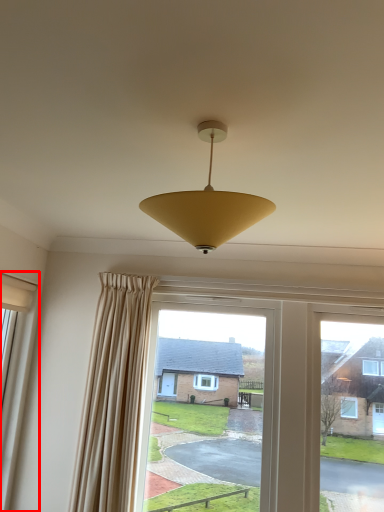
Question: Where is window (annotated by the red box) located in relation to lamp in the image?

Choices:
 (A) right
 (B) left

Answer: (B)